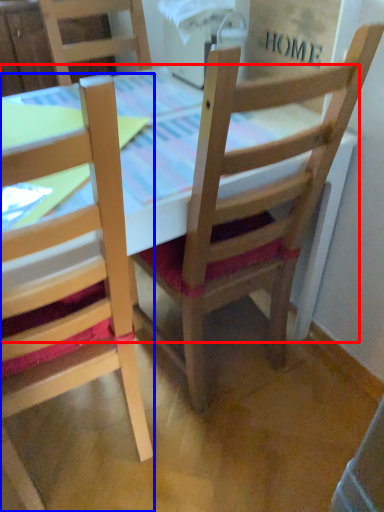
Question: Among these objects, which one is nearest to the camera, table (highlighted by a red box) or chair (highlighted by a blue box)?

Choices:
 (A) table
 (B) chair

Answer: (B)